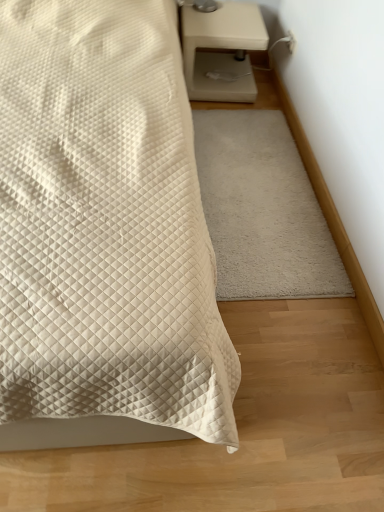
Find the location of a particular element. Image resolution: width=384 pixels, height=512 pixels. free point below white soft rug at center (from a real-world perspective) is located at coordinates (253, 190).